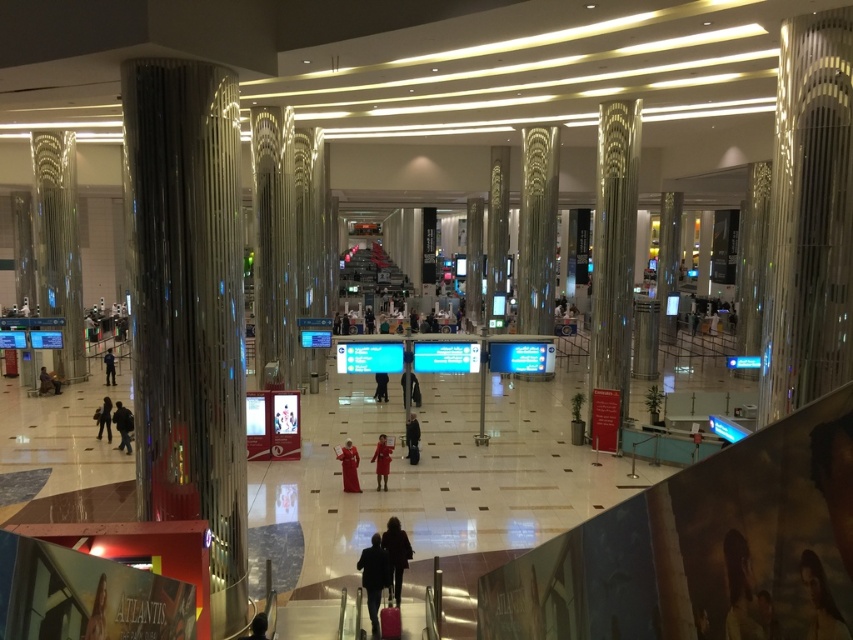
You are standing at the entrance of the airport terminal and see two points marked on the floor. The first point is labeled as point (39, 381) and the second point is labeled as point (109, 364). Which point is closer to you?

Point (39, 381) is in front of point (109, 364), so it is closer to you.

You are standing in the airport terminal and see two points marked on the floor. The first point is at coordinate point (126, 412) and the second is at coordinate point (103, 412). Which point is closer to your current position?

Point (126, 412) is closer to the camera than point (103, 412), so the first point is closer to your current position.